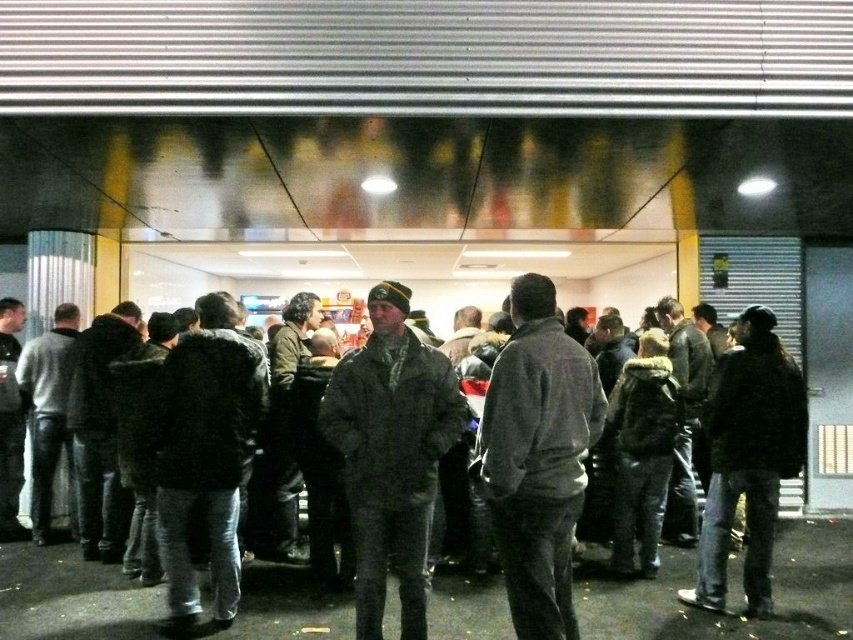
You are a photographer trying to capture a photo of the dark gray jacket at center and the dark brown leather jacket at right. Which jacket should you focus on first if you want to include both in your frame without moving the camera?

The dark gray jacket at center is positioned over the dark brown leather jacket at right, so you should focus on the dark gray jacket at center first to ensure it appears in front and avoid it being obscured by the other jacket.

You are a delivery person standing at the entrance of the building and need to deliver a package to the person wearing the dark gray jacket at center and the dark brown leather jacket at right. The delivery robot you are using has a maximum delivery range of 5 feet. Can the robot deliver the package to both individuals in one trip without moving?

The dark gray jacket at center is 4.70 feet away from the dark brown leather jacket at right. Since the robot has a maximum delivery range of 5 feet, it can deliver the package to both individuals in one trip without moving because the distance between them is within the robot s range.